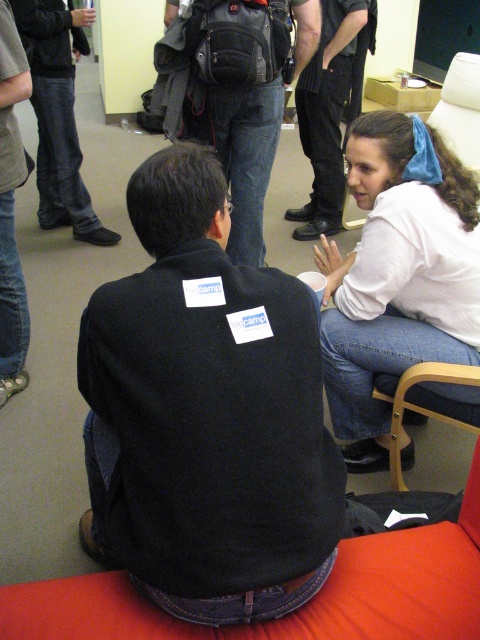
You are organizing a charity clothing drive and need to determine if the black fleece jacket at center can fit into a donation box that is the same size as the matte black backpack at center. Based on their sizes, will the jacket fit?

The black fleece jacket at center is larger than the matte black backpack at center, so it will not fit into a donation box of the backpacks size.